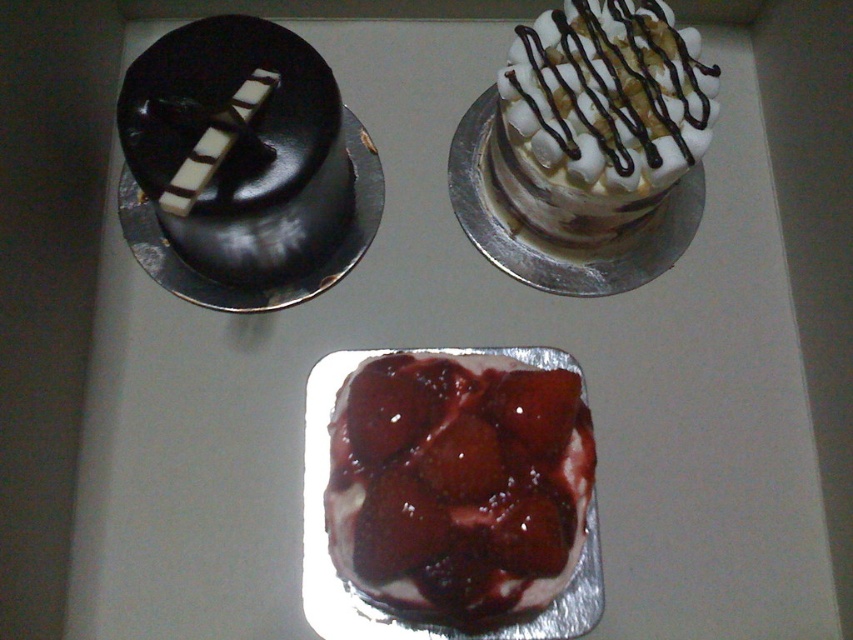
Question: Does semi-glossy white cake at center appear under white marshmallow cake at upper right?

Choices:
 (A) yes
 (B) no

Answer: (A)

Question: Which point appears farthest from the camera in this image?

Choices:
 (A) (323, 150)
 (B) (189, 196)

Answer: (A)

Question: Can you confirm if semi-glossy white cake at center is thinner than smooth chocolate cake at upper left?

Choices:
 (A) yes
 (B) no

Answer: (B)

Question: Which object is positioned farthest from the shiny dark chocolate cake at upper left?

Choices:
 (A) semi-glossy white cake at center
 (B) smooth chocolate cake at upper left

Answer: (A)

Question: Does white marshmallow cake at upper right have a lesser width compared to smooth chocolate cake at upper left?

Choices:
 (A) yes
 (B) no

Answer: (B)

Question: Which object appears closest to the camera in this image?

Choices:
 (A) smooth chocolate cake at upper left
 (B) semi-glossy white cake at center
 (C) shiny dark chocolate cake at upper left
 (D) white marshmallow cake at upper right

Answer: (B)